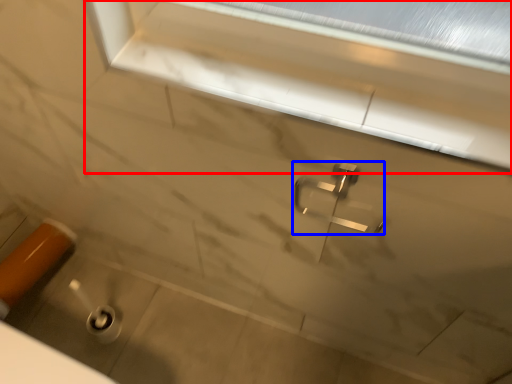
Question: Which object is closer to the camera taking this photo, window frame (highlighted by a red box) or tap (highlighted by a blue box)?

Choices:
 (A) window frame
 (B) tap

Answer: (A)